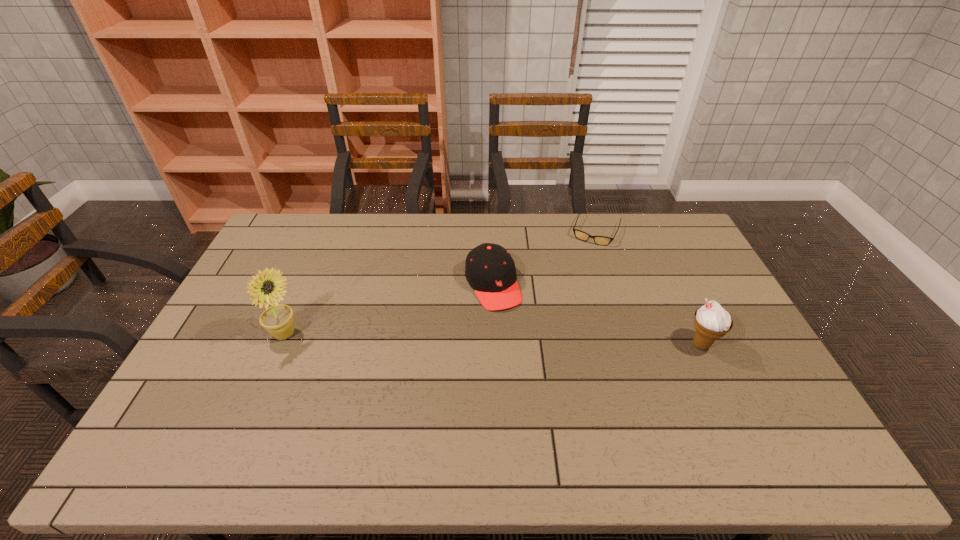
Where is `free space on the desktop that is between the tallest object and the rightmost object and is positioned on the front-facing side of the second farthest object`? free space on the desktop that is between the tallest object and the rightmost object and is positioned on the front-facing side of the second farthest object is located at coordinates (521, 340).

This screenshot has height=540, width=960. Find the location of `free spot on the desktop that is between the leftmost object and the rightmost object and is positioned on the front-facing side of the shortest object`. free spot on the desktop that is between the leftmost object and the rightmost object and is positioned on the front-facing side of the shortest object is located at coordinates point(548,341).